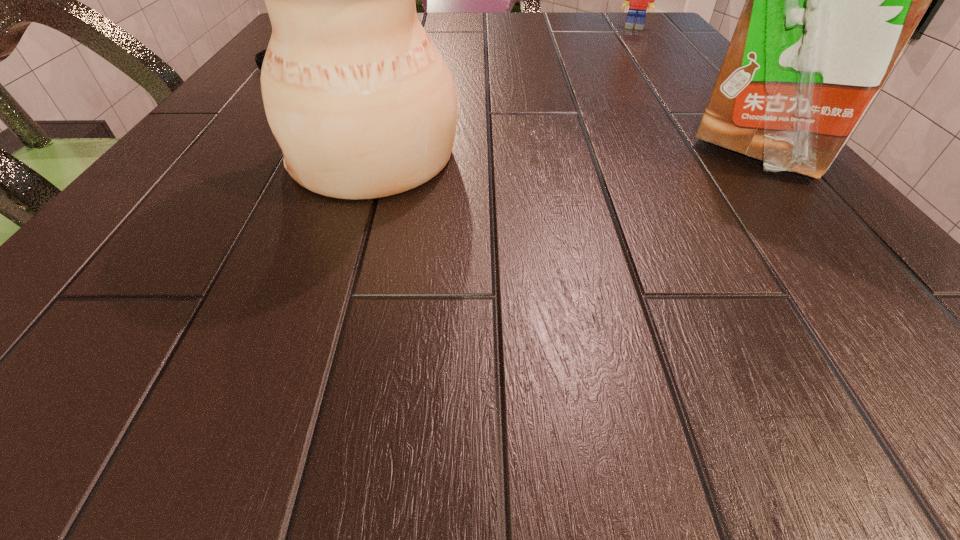
What are the coordinates of `vacant space at the far edge of the desktop` in the screenshot? It's located at (552, 32).

Where is `vacant space at the near edge`? Image resolution: width=960 pixels, height=540 pixels. vacant space at the near edge is located at coordinates (566, 247).

Find the location of a particular element. The height and width of the screenshot is (540, 960). vacant area at the left edge of the desktop is located at coordinates (240, 90).

This screenshot has width=960, height=540. Identify the location of vacant space at the near left corner of the desktop. (156, 257).

Find the location of a particular element. This screenshot has width=960, height=540. vacant space at the far right corner is located at coordinates (650, 16).

Find the location of a particular element. free space between the pottery and the carton is located at coordinates (567, 152).

Locate an element on the screen. The height and width of the screenshot is (540, 960). free space between the farthest object and the wristband is located at coordinates (461, 48).

Where is `blank region between the third object from right to left and the carton`? This screenshot has height=540, width=960. blank region between the third object from right to left and the carton is located at coordinates (567, 152).

Locate an element on the screen. The image size is (960, 540). vacant region between the carton and the leftmost object is located at coordinates (524, 108).

This screenshot has height=540, width=960. What are the coordinates of `free space between the carton and the third object from right to left` in the screenshot? It's located at (567, 152).